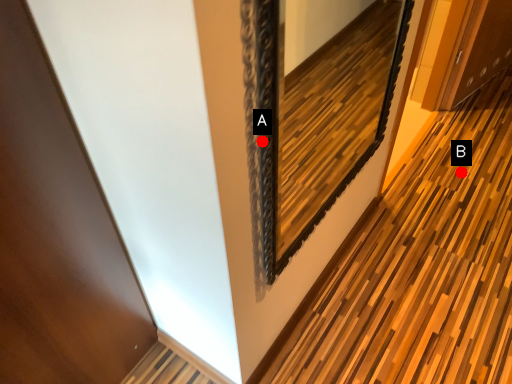
Question: Two points are circled on the image, labeled by A and B beside each circle. Which point is closer to the camera?

Choices:
 (A) A is closer
 (B) B is closer

Answer: (A)